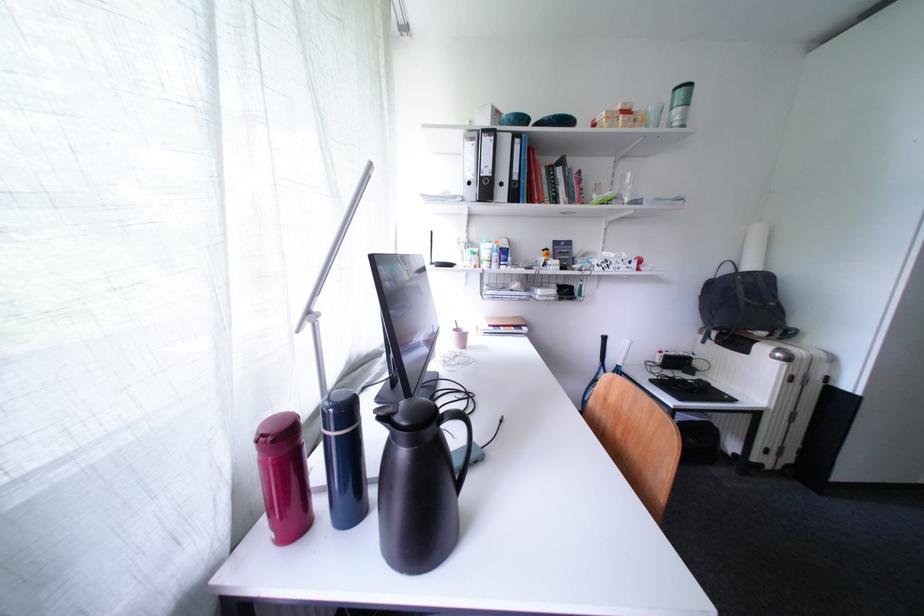
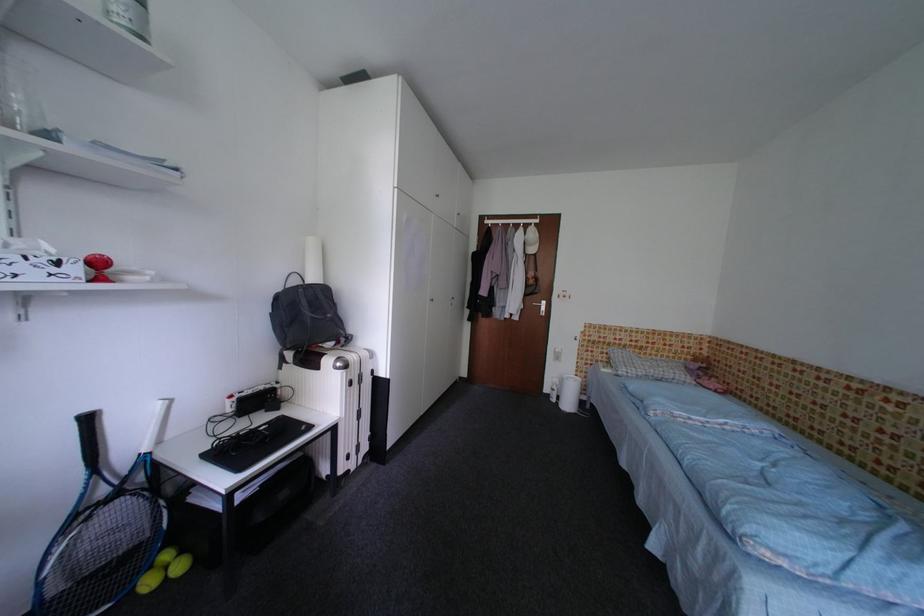
In the second image, find the point that corresponds to point (612, 341) in the first image.

(98, 422)